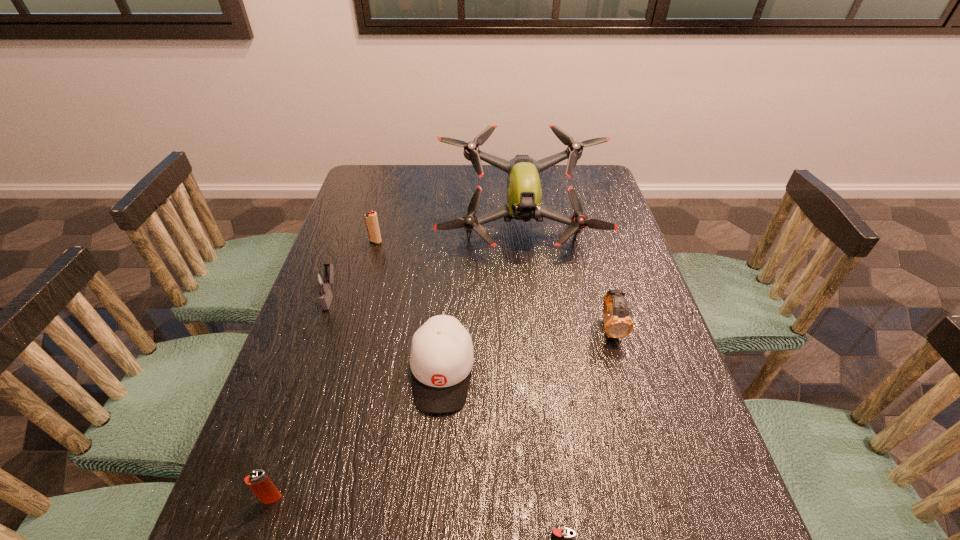
Identify the location of vacant area that lies between the fifth object from right to left and the second farthest igniter. point(353,269).

You are a GUI agent. You are given a task and a screenshot of the screen. Output one action in this format:
    pyautogui.click(x=<x>, y=<y>)
    Task: Click on the empty space that is in between the second farthest igniter and the baseball cap
    This screenshot has height=540, width=960.
    Given the screenshot: What is the action you would take?
    pyautogui.click(x=386, y=334)

Locate an element on the screen. Image resolution: width=960 pixels, height=540 pixels. vacant area that lies between the tallest object and the baseball cap is located at coordinates (482, 300).

Where is `free space between the watch and the baseball cap`? The image size is (960, 540). free space between the watch and the baseball cap is located at coordinates (526, 350).

This screenshot has height=540, width=960. What are the coordinates of `free spot between the drone and the third object from left to right` in the screenshot? It's located at 448,235.

At what (x,y) coordinates should I click in order to perform the action: click on vacant point located between the baseball cap and the watch. Please return your answer as a coordinate pair (x, y). Image resolution: width=960 pixels, height=540 pixels. Looking at the image, I should click on (526, 350).

Identify which object is the closest to the baseball cap. Please provide its 2D coordinates. Your answer should be formatted as a tuple, i.e. [(x, y)], where the tuple contains the x and y coordinates of a point satisfying the conditions above.

[(322, 281)]

Image resolution: width=960 pixels, height=540 pixels. I want to click on object that is the third closest to the second farthest igniter, so click(x=524, y=193).

At what (x,y) coordinates should I click in order to perform the action: click on the second closest igniter to the rightmost igniter. Please return your answer as a coordinate pair (x, y). Looking at the image, I should click on (322, 281).

Choose which igniter is the nearest neighbor to the watch. Please provide its 2D coordinates. Your answer should be formatted as a tuple, i.e. [(x, y)], where the tuple contains the x and y coordinates of a point satisfying the conditions above.

[(562, 539)]